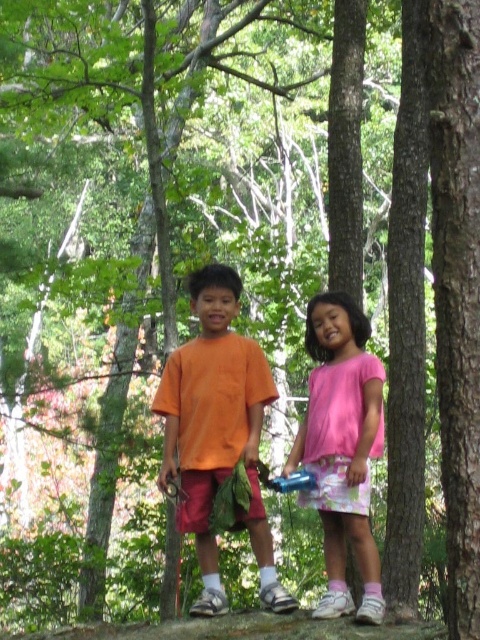
Question: In this image, where is orange cotton shirt at center located relative to pink fabric dress at center?

Choices:
 (A) below
 (B) above

Answer: (B)

Question: Which point is farther from the camera taking this photo?

Choices:
 (A) (340, 580)
 (B) (274, 394)

Answer: (B)

Question: From the image, what is the correct spatial relationship of orange cotton shirt at center in relation to pink fabric dress at center?

Choices:
 (A) below
 (B) above

Answer: (B)

Question: Is orange cotton shirt at center to the right of pink fabric dress at center from the viewer's perspective?

Choices:
 (A) yes
 (B) no

Answer: (B)

Question: Which of the following is the closest to the observer?

Choices:
 (A) (263, 378)
 (B) (355, 509)

Answer: (B)

Question: Which point is closer to the camera taking this photo?

Choices:
 (A) coord(372,592)
 (B) coord(251,458)

Answer: (A)